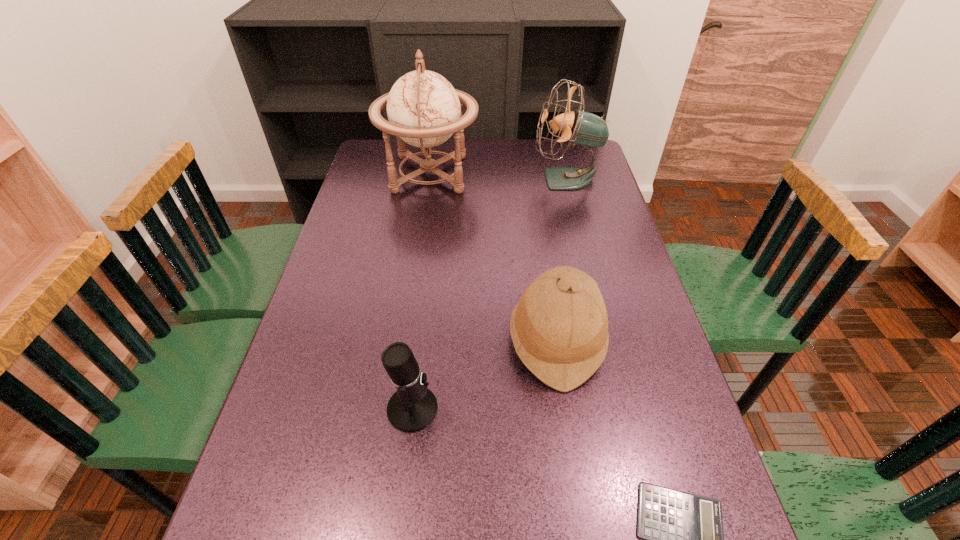
This screenshot has height=540, width=960. I want to click on the tallest object, so click(x=424, y=110).

You are a GUI agent. You are given a task and a screenshot of the screen. Output one action in this format:
    pyautogui.click(x=<x>, y=<y>)
    Task: Click on the second tallest object
    The image size is (960, 540).
    Given the screenshot: What is the action you would take?
    (x=580, y=127)

I want to click on hat, so click(x=559, y=329).

Identify the location of the fourth tallest object. The width and height of the screenshot is (960, 540). (413, 406).

In order to click on vacant area situated on the front-facing side of the globe in this screenshot , I will do `click(579, 174)`.

The image size is (960, 540). What are the coordinates of `vacant space located on the front-facing side of the second tallest object for air flow` in the screenshot? It's located at (513, 179).

Identify the location of vacant point located 0.090m on the front-facing side of the second tallest object for air flow. (507, 179).

Identify the location of blank area located on the front-facing side of the second tallest object for air flow. This screenshot has width=960, height=540. (433, 179).

You are a GUI agent. You are given a task and a screenshot of the screen. Output one action in this format:
    pyautogui.click(x=<x>, y=<y>)
    Task: Click on the free region located 0.230m on the front-facing side of the hat
    The width and height of the screenshot is (960, 540).
    Given the screenshot: What is the action you would take?
    pyautogui.click(x=414, y=340)

Locate an element on the screen. This screenshot has height=540, width=960. vacant space located on the front-facing side of the hat is located at coordinates (351, 340).